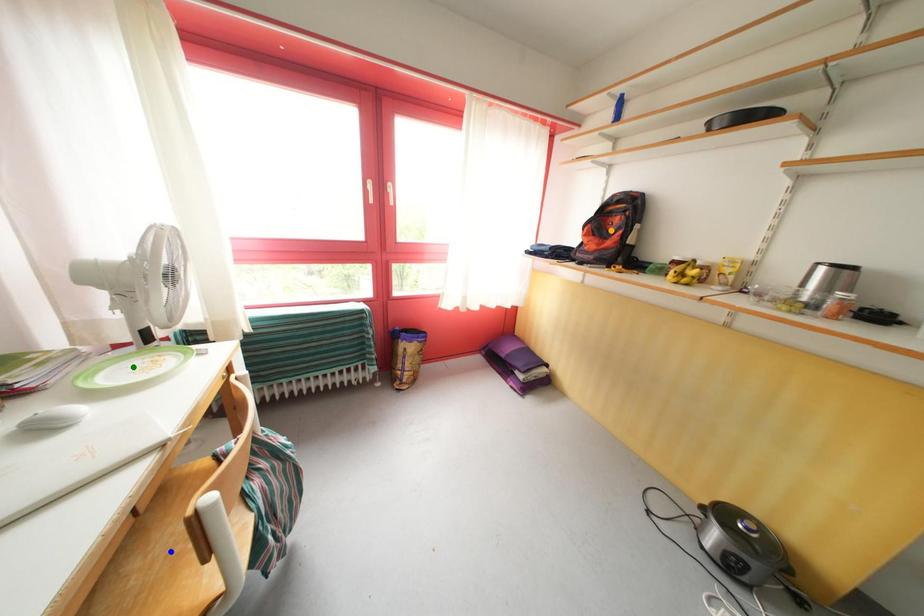
Order these from nearest to farthest:
A) green point
B) blue point
C) orange point

blue point → green point → orange point